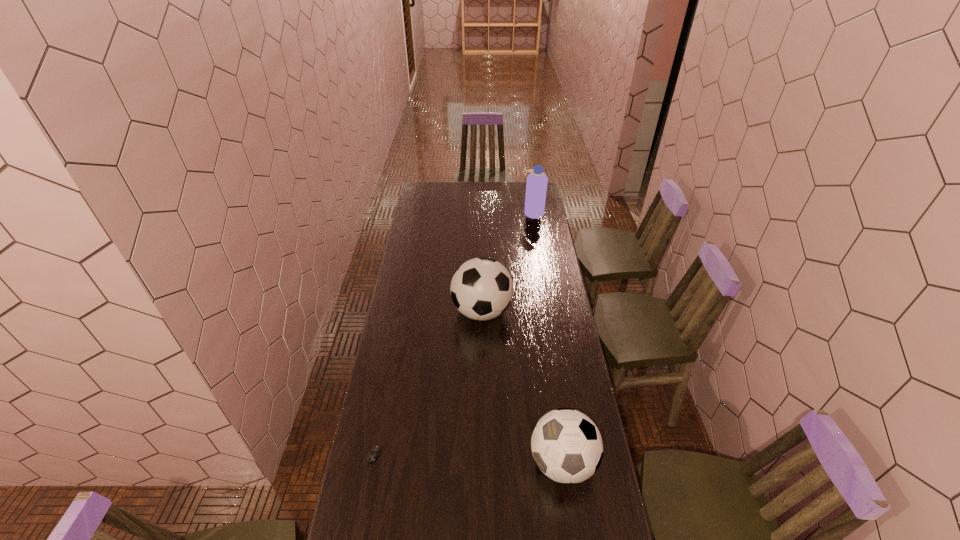
Locate an element on the screen. This screenshot has width=960, height=540. vacant area that lies between the shorter soccer ball and the farther soccer ball is located at coordinates (522, 387).

Find the location of `vacant area that lies between the computer mouse and the third tallest object`. vacant area that lies between the computer mouse and the third tallest object is located at coordinates (468, 459).

The width and height of the screenshot is (960, 540). In order to click on unoccupied position between the second object from left to right and the shampoo in this screenshot , I will do `click(508, 262)`.

I want to click on vacant space in between the shortest object and the taller soccer ball, so click(x=428, y=383).

Image resolution: width=960 pixels, height=540 pixels. Identify the location of vacant space that is in between the leftmost object and the shampoo. click(x=454, y=334).

Where is `unoccupied area between the computer mouse and the right soccer ball`? The width and height of the screenshot is (960, 540). unoccupied area between the computer mouse and the right soccer ball is located at coordinates (468, 459).

Locate an element on the screen. The image size is (960, 540). vacant area that lies between the shortest object and the shorter soccer ball is located at coordinates (468, 459).

The width and height of the screenshot is (960, 540). Find the location of `unoccupied position between the shampoo and the third tallest object`. unoccupied position between the shampoo and the third tallest object is located at coordinates (548, 338).

Find the location of a particular element. vacant space that's between the nearer soccer ball and the second farthest object is located at coordinates (522, 387).

Where is `object that is the closest to the right soccer ball`? This screenshot has height=540, width=960. object that is the closest to the right soccer ball is located at coordinates (481, 288).